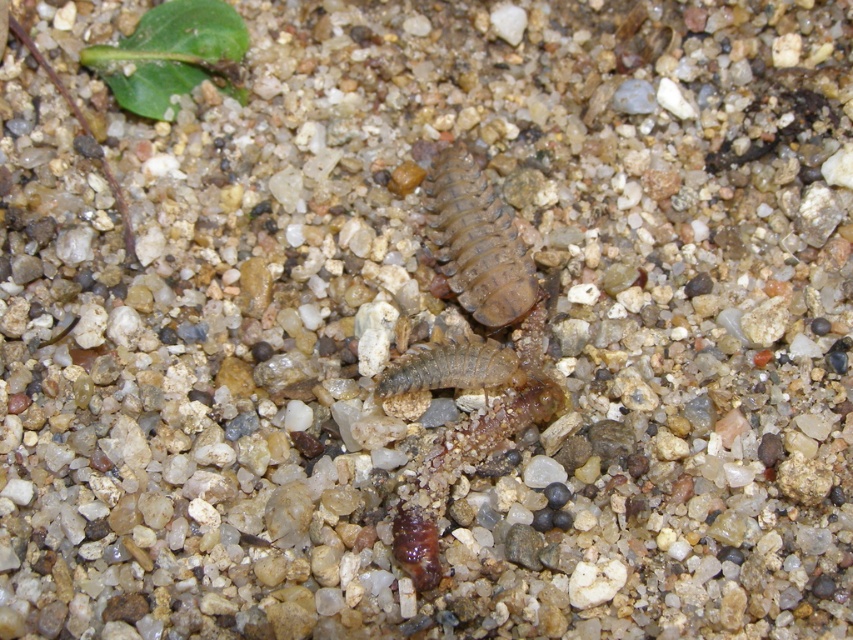
Question: Does brown rough centipede at center have a lesser width compared to brown fuzzy caterpillar at lower center?

Choices:
 (A) yes
 (B) no

Answer: (B)

Question: Does brown rough centipede at center have a lesser width compared to brown fuzzy caterpillar at lower center?

Choices:
 (A) yes
 (B) no

Answer: (B)

Question: Which point is farther from the camera taking this photo?

Choices:
 (A) (486, 250)
 (B) (418, 577)

Answer: (A)

Question: Which object is farther from the camera taking this photo?

Choices:
 (A) brown rough centipede at center
 (B) brown fuzzy caterpillar at center
 (C) brown fuzzy caterpillar at lower center

Answer: (A)

Question: Is brown rough centipede at center positioned at the back of brown fuzzy caterpillar at center?

Choices:
 (A) no
 (B) yes

Answer: (B)

Question: Considering the real-world distances, which object is farthest from the brown fuzzy caterpillar at lower center?

Choices:
 (A) brown fuzzy caterpillar at center
 (B) brown rough centipede at center

Answer: (B)